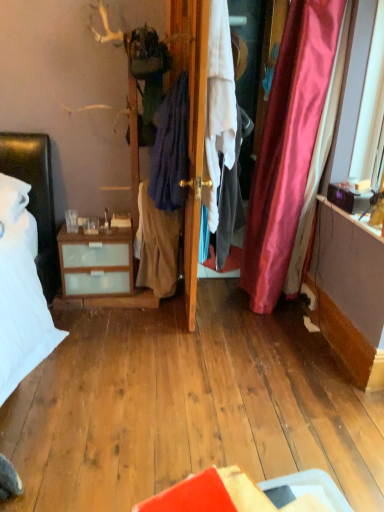
Question: Does wooden door at center have a lesser height compared to white fabric screen door at center?

Choices:
 (A) yes
 (B) no

Answer: (A)

Question: Considering the relative sizes of wooden door at center and white fabric screen door at center in the image provided, is wooden door at center wider than white fabric screen door at center?

Choices:
 (A) yes
 (B) no

Answer: (A)

Question: Is wooden door at center closer to camera compared to white fabric screen door at center?

Choices:
 (A) yes
 (B) no

Answer: (A)

Question: From a real-world perspective, does wooden door at center sit lower than white fabric screen door at center?

Choices:
 (A) yes
 (B) no

Answer: (B)

Question: From the image's perspective, is wooden door at center under white fabric screen door at center?

Choices:
 (A) no
 (B) yes

Answer: (B)

Question: From their relative heights in the image, would you say beige cotton skirt at center, which is the first clothing in left-to-right order, is taller or shorter than white fabric screen door at center?

Choices:
 (A) tall
 (B) short

Answer: (B)

Question: From the image's perspective, relative to white fabric screen door at center, is beige cotton skirt at center, which is the first clothing in left-to-right order, above or below?

Choices:
 (A) below
 (B) above

Answer: (A)

Question: Is beige cotton skirt at center, which is the first clothing in left-to-right order, wider or thinner than white fabric screen door at center?

Choices:
 (A) wide
 (B) thin

Answer: (A)

Question: Based on their positions, is beige cotton skirt at center, positioned as the third clothing in right-to-left order, located to the left or right of white fabric screen door at center?

Choices:
 (A) right
 (B) left

Answer: (B)

Question: Is point (185, 269) closer or farther from the camera than point (183, 139)?

Choices:
 (A) farther
 (B) closer

Answer: (A)

Question: Is white fabric screen door at center to the left or to the right of dark blue fabric at center, which ranks as the 2th clothing in left-to-right order, in the image?

Choices:
 (A) left
 (B) right

Answer: (B)

Question: Is white fabric screen door at center bigger or smaller than dark blue fabric at center, the second clothing in the right-to-left sequence?

Choices:
 (A) small
 (B) big

Answer: (B)

Question: Is white fabric screen door at center inside the boundaries of dark blue fabric at center, the second clothing in the right-to-left sequence, or outside?

Choices:
 (A) inside
 (B) outside

Answer: (B)

Question: Is white fabric screen door at center taller or shorter than white cotton shirt at center, which is the third clothing in left-to-right order?

Choices:
 (A) tall
 (B) short

Answer: (A)

Question: Choose the correct answer: Is white fabric screen door at center inside white cotton shirt at center, which is the third clothing in left-to-right order, or outside it?

Choices:
 (A) inside
 (B) outside

Answer: (B)